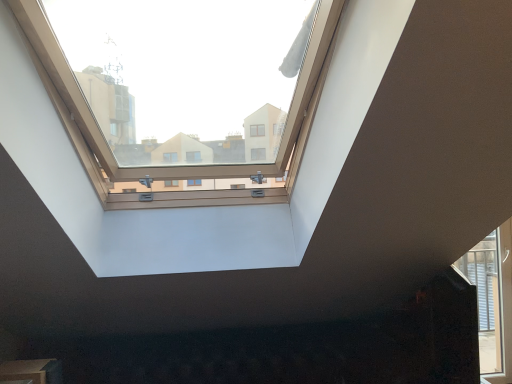
Image resolution: width=512 pixels, height=384 pixels. I want to click on empty space that is ontop of matte wood table at lower left (from a real-world perspective), so click(x=16, y=364).